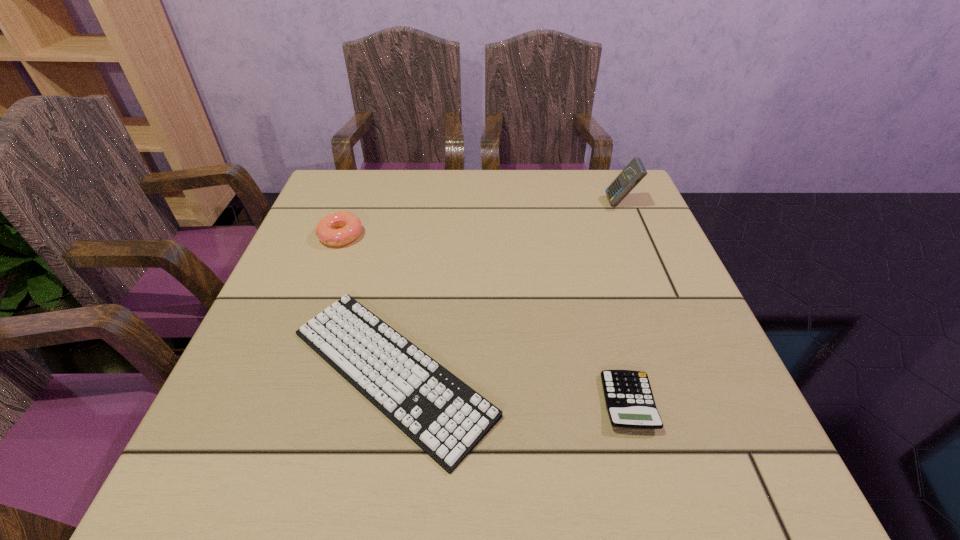
Locate an element on the screen. vacant space located 0.390m on the right of the third shortest object is located at coordinates (524, 236).

You are a GUI agent. You are given a task and a screenshot of the screen. Output one action in this format:
    pyautogui.click(x=<x>, y=<y>)
    Task: Click on the free region located on the back of the shorter calculator
    The image size is (960, 540).
    Given the screenshot: What is the action you would take?
    pyautogui.click(x=587, y=251)

At what (x,y) coordinates should I click in order to perform the action: click on vacant region located 0.130m on the back of the computer keyboard. Please return your answer as a coordinate pair (x, y). This screenshot has width=960, height=540. Looking at the image, I should click on (411, 259).

Identify the location of object located at the far edge. (634, 172).

This screenshot has height=540, width=960. What are the coordinates of `object at the near edge` in the screenshot? It's located at (446, 418).

Locate an element on the screen. doughnut present at the left edge is located at coordinates (339, 228).

Find the location of a particular element. The image size is (960, 540). computer keyboard positioned at the left edge is located at coordinates (446, 418).

Locate an element on the screen. This screenshot has width=960, height=540. object positioned at the near left corner is located at coordinates (446, 418).

Locate an element on the screen. Image resolution: width=960 pixels, height=540 pixels. object present at the far right corner is located at coordinates (634, 172).

In the image, there is a desktop. Find the location of `free space at the far edge`. free space at the far edge is located at coordinates (448, 196).